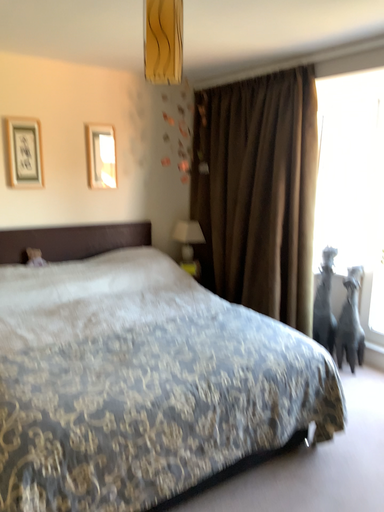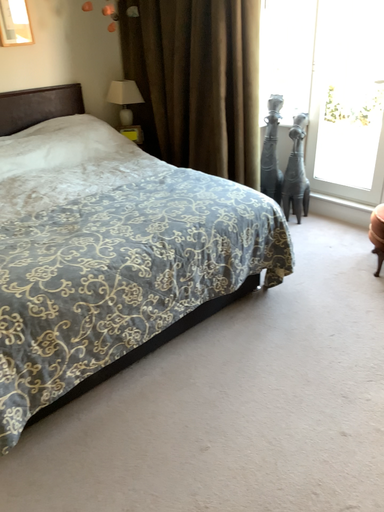
Question: How did the camera likely rotate when shooting the video?

Choices:
 (A) rotated right
 (B) rotated left

Answer: (A)